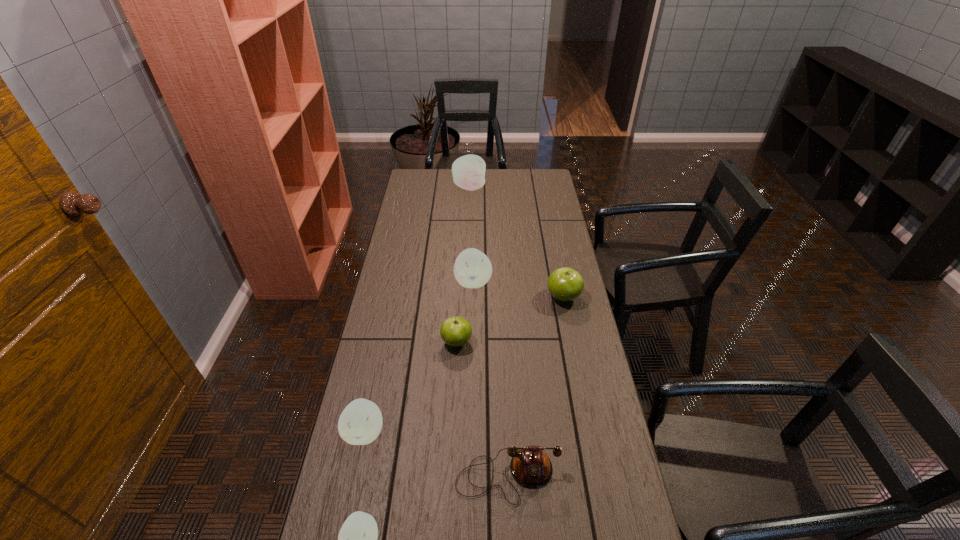
In order to click on vacant area at the left edge in this screenshot , I will do `click(426, 234)`.

You are a GUI agent. You are given a task and a screenshot of the screen. Output one action in this format:
    pyautogui.click(x=<x>, y=<y>)
    Task: Click on the vacant space at the right edge of the desktop
    
    Given the screenshot: What is the action you would take?
    pyautogui.click(x=599, y=416)

This screenshot has height=540, width=960. What are the coordinates of `blank space at the far left corner of the desktop` in the screenshot? It's located at (410, 188).

Where is `free space between the pink telephone and the third farthest white apple`? This screenshot has height=540, width=960. free space between the pink telephone and the third farthest white apple is located at coordinates (436, 454).

At what (x,y) coordinates should I click in order to perform the action: click on vacant space in between the tallest apple and the farther green apple. Please return your answer as a coordinate pair (x, y). Looking at the image, I should click on (516, 242).

I want to click on free space between the second nearest apple and the telephone, so click(x=436, y=454).

Where is `vacant space that is in between the telephone and the tallest object`? This screenshot has height=540, width=960. vacant space that is in between the telephone and the tallest object is located at coordinates click(x=489, y=332).

Locate an element on the screen. free area in between the right green apple and the left green apple is located at coordinates (510, 320).

Identify the location of free space between the biggest white apple and the pink telephone. This screenshot has width=960, height=540. (489, 332).

Find the location of a particular element. the third closest object to the third smallest white apple is located at coordinates (360, 423).